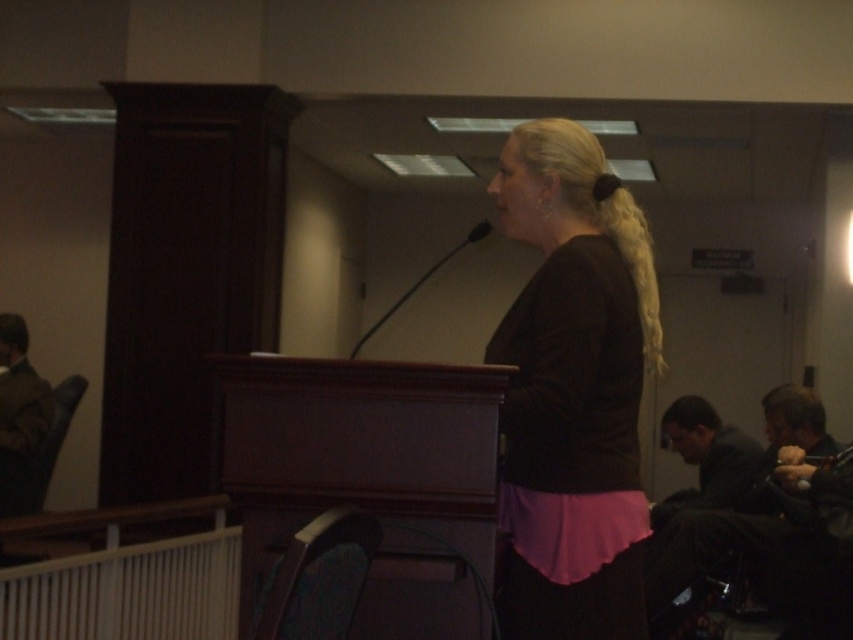
Where is `matte brown blouse at center`? matte brown blouse at center is located at coordinates (572, 390).

Which is in front, point (503, 396) or point (480, 237)?

Point (503, 396) is more forward.

Which is in front, point (641, 362) or point (474, 225)?

Point (641, 362) is more forward.

Identify the location of matte brown blouse at center. (572, 390).